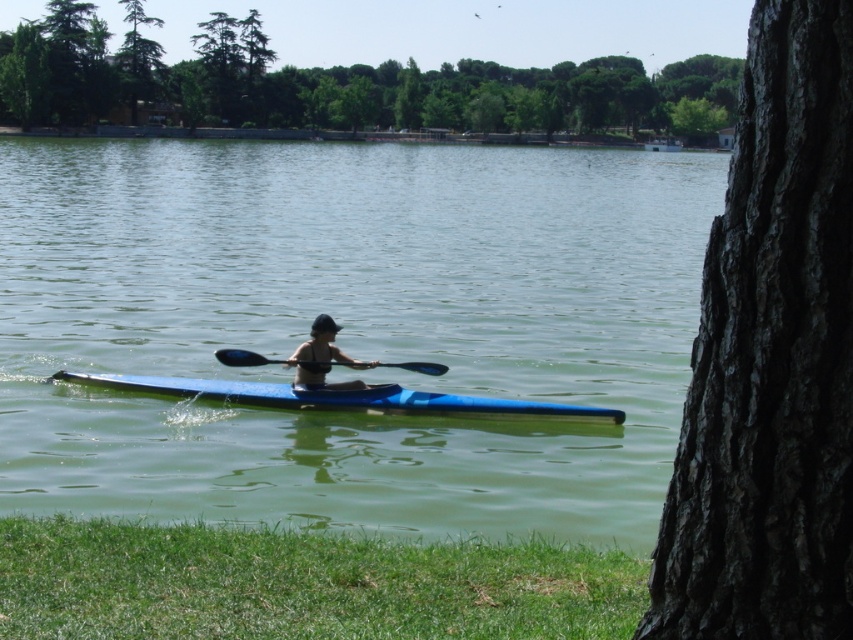
Is point (415, 534) closer to viewer compared to point (811, 452)?

No, it is not.

Is green water at center positioned before dark bark tree trunk at right?

No, green water at center is behind dark bark tree trunk at right.

Does point (103, 452) lie behind point (695, 620)?

Yes, point (103, 452) is farther from viewer.

What are the coordinates of `green water at center` in the screenshot? It's located at (349, 328).

Looking at this image, does green water at center appear on the right side of blue plastic paddle at center?

In fact, green water at center is to the left of blue plastic paddle at center.

Can you confirm if green water at center is thinner than blue plastic paddle at center?

No.

Which is behind, point (254, 228) or point (311, 358)?

Positioned behind is point (254, 228).

The width and height of the screenshot is (853, 640). Find the location of `green water at center`. green water at center is located at coordinates [x=349, y=328].

Does dark bark tree trunk at right appear over matte black kayak at center?

No, dark bark tree trunk at right is not above matte black kayak at center.

Find the location of `dark bark tree trunk at right`. dark bark tree trunk at right is located at coordinates (770, 358).

The height and width of the screenshot is (640, 853). What are the coordinates of `dark bark tree trunk at right` in the screenshot? It's located at (770, 358).